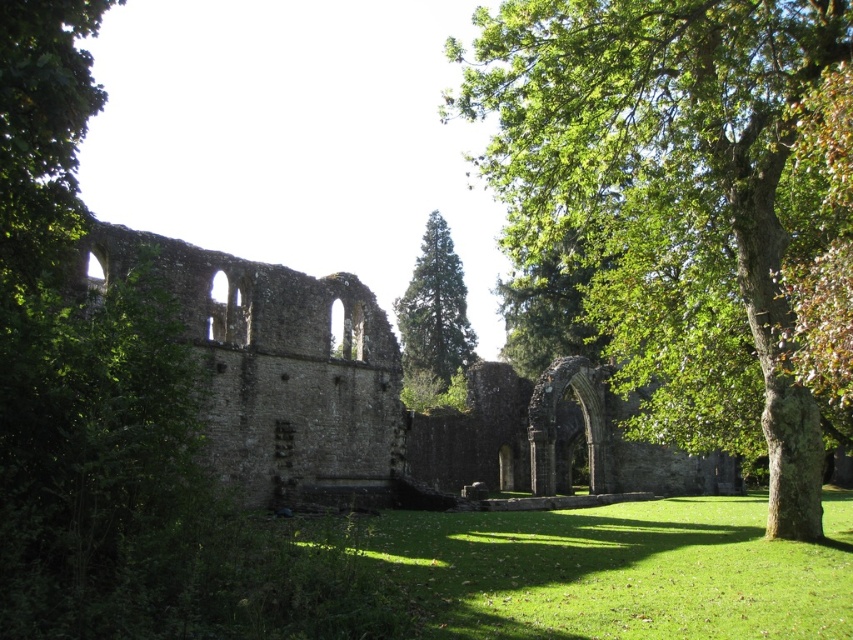
Question: Does green leafy tree at center appear over stone archway at center?

Choices:
 (A) yes
 (B) no

Answer: (A)

Question: Which is nearer to the green leafy tree at center?

Choices:
 (A) green grass at lower center
 (B) stone archway at center
 (C) green coniferous tree at center

Answer: (A)

Question: Is green leafy tree at center positioned before green grass at lower center?

Choices:
 (A) yes
 (B) no

Answer: (B)

Question: Which of these objects is positioned farthest from the green leafy tree at center?

Choices:
 (A) stone archway at center
 (B) green grass at lower center
 (C) green coniferous tree at center

Answer: (C)

Question: Does stone archway at center have a larger size compared to green grass at lower center?

Choices:
 (A) yes
 (B) no

Answer: (A)

Question: Among these objects, which one is farthest from the camera?

Choices:
 (A) stone archway at center
 (B) green coniferous tree at center
 (C) green grass at lower center

Answer: (B)